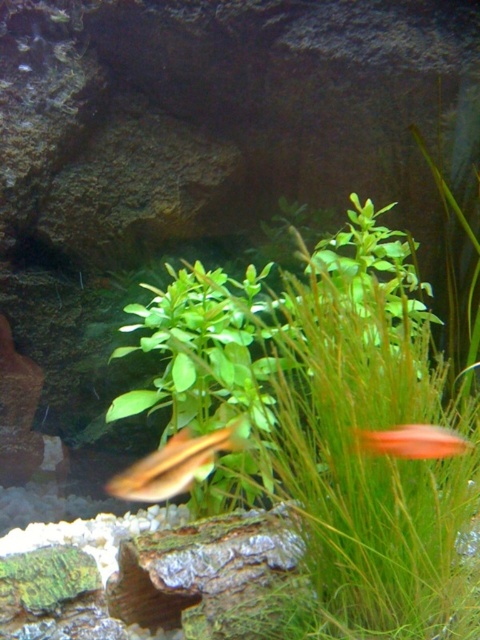
From the picture: Measure the distance between point (x=145, y=467) and camera.

Point (x=145, y=467) is 8.00 feet from camera.

Is translucent yellowish fish at center further to camera compared to orange glossy fish at right?

That is True.

Does point (142, 472) come farther from viewer compared to point (423, 456)?

Yes, it is.

This screenshot has height=640, width=480. In order to click on translucent yellowish fish at center in this screenshot , I will do `click(177, 464)`.